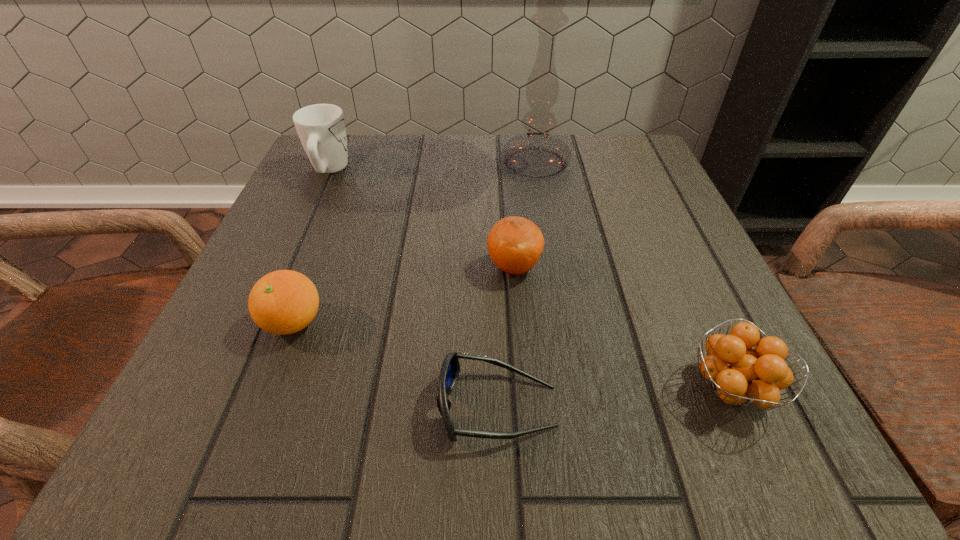
I want to click on orange fruit that can be found as the second closest to the rightmost orange fruit, so click(283, 302).

You are a GUI agent. You are given a task and a screenshot of the screen. Output one action in this format:
    pyautogui.click(x=<x>, y=<y>)
    Task: Click on the free space that satisfies the following two spatial constraints: 1. on the front side of the nearest orange fruit; 2. on the front-facing side of the shortest object
    The height and width of the screenshot is (540, 960).
    Given the screenshot: What is the action you would take?
    pyautogui.click(x=738, y=406)

Find the location of `vacant region that satisfies the following two spatial constraints: 1. on the front-facing side of the table lamp; 2. on the right side of the rightmost orange fruit`. vacant region that satisfies the following two spatial constraints: 1. on the front-facing side of the table lamp; 2. on the right side of the rightmost orange fruit is located at coordinates (573, 389).

Where is `free space that satisfies the following two spatial constraints: 1. on the front-facing side of the table lamp; 2. on the front-facing side of the shortest object`? The width and height of the screenshot is (960, 540). free space that satisfies the following two spatial constraints: 1. on the front-facing side of the table lamp; 2. on the front-facing side of the shortest object is located at coordinates (576, 406).

Where is `vacant region that satisfies the following two spatial constraints: 1. on the front side of the fourth nearest object; 2. on the front-facing side of the shortest object`? This screenshot has width=960, height=540. vacant region that satisfies the following two spatial constraints: 1. on the front side of the fourth nearest object; 2. on the front-facing side of the shortest object is located at coordinates (525, 406).